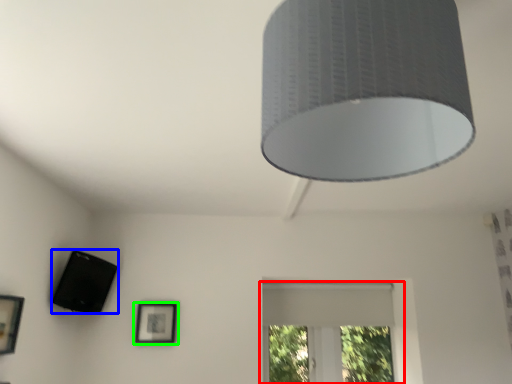
Question: Based on their relative distances, which object is farther from window (highlighted by a red box)? Choose from speaker (highlighted by a blue box) and picture frame (highlighted by a green box).

Choices:
 (A) speaker
 (B) picture frame

Answer: (A)